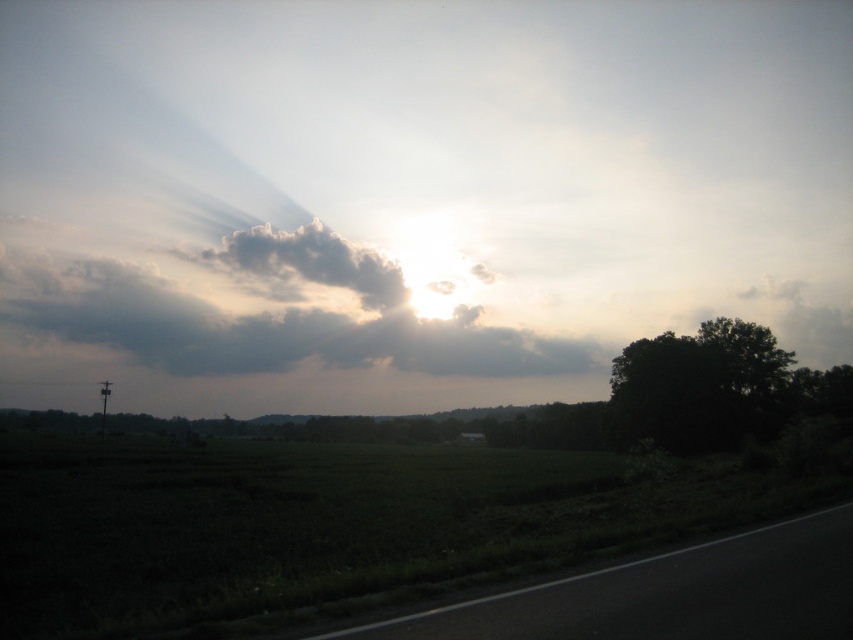
You are driving along the road and see the dark gray cloud at upper center and the dark green leafy tree at right. Which object is higher in the sky?

The dark gray cloud at upper center is higher in the sky than the dark green leafy tree at right because it is positioned above the tree.